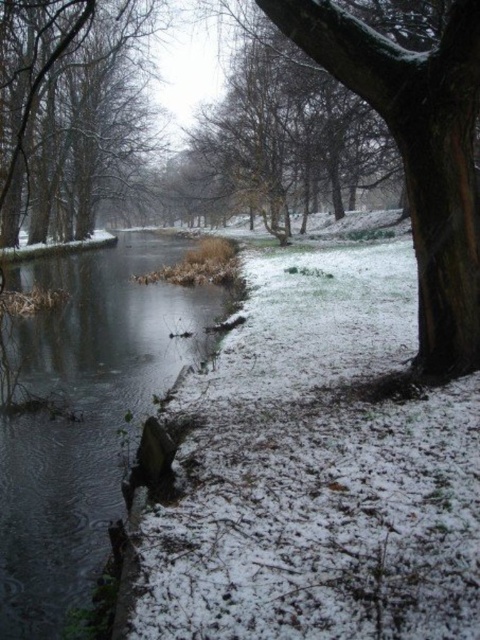
Does clear water at center have a lesser height compared to smooth bark tree at left?

Correct, clear water at center is not as tall as smooth bark tree at left.

Can you confirm if clear water at center is positioned to the right of smooth bark tree at left?

Indeed, clear water at center is positioned on the right side of smooth bark tree at left.

Which is behind, point (86, 291) or point (29, 234)?

Positioned behind is point (29, 234).

At what (x,y) coordinates should I click in order to perform the action: click on clear water at center. Please return your answer as a coordinate pair (x, y). The width and height of the screenshot is (480, 640). Looking at the image, I should click on (84, 416).